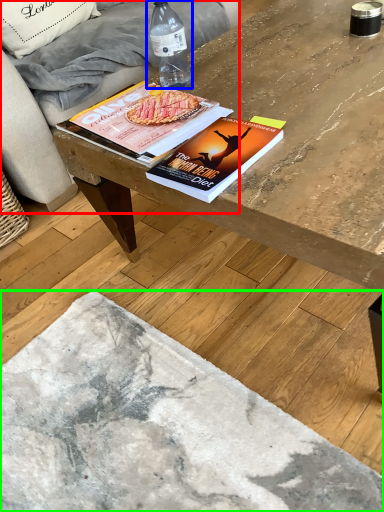
Question: Which is farther away from studio couch (highlighted by a red box)? bottle (highlighted by a blue box) or concrete (highlighted by a green box)?

Choices:
 (A) bottle
 (B) concrete

Answer: (B)